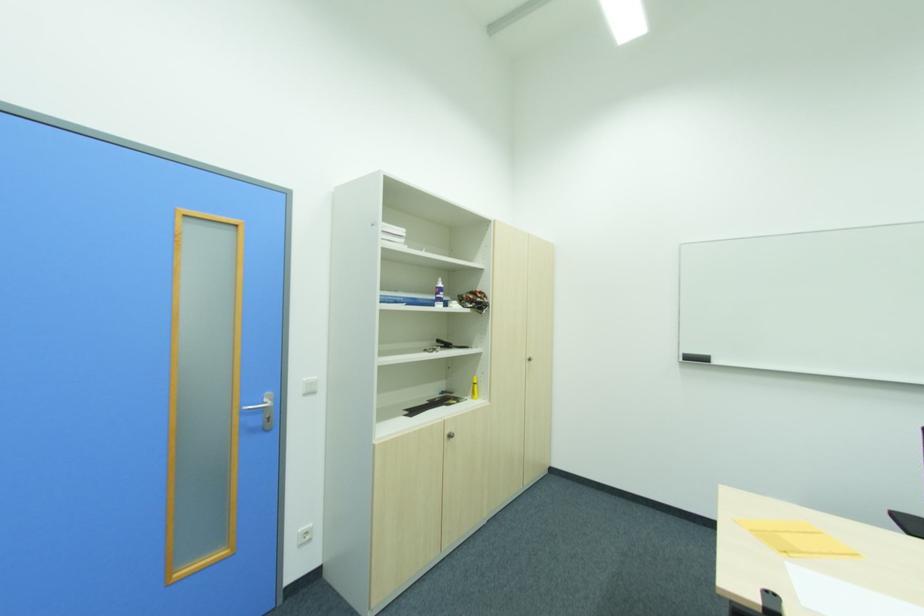
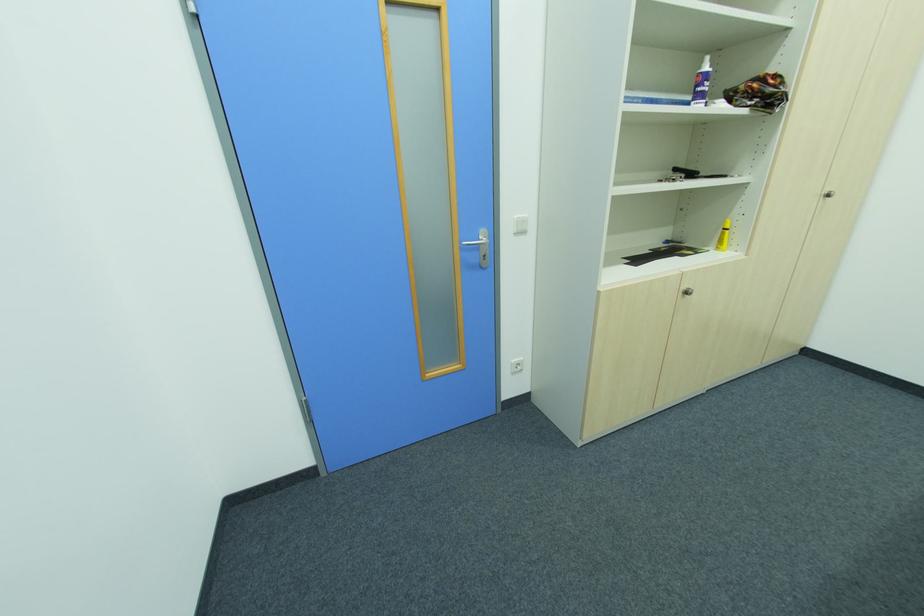
In the second image, find the point that corresponds to point 313,394 in the first image.

(525, 233)